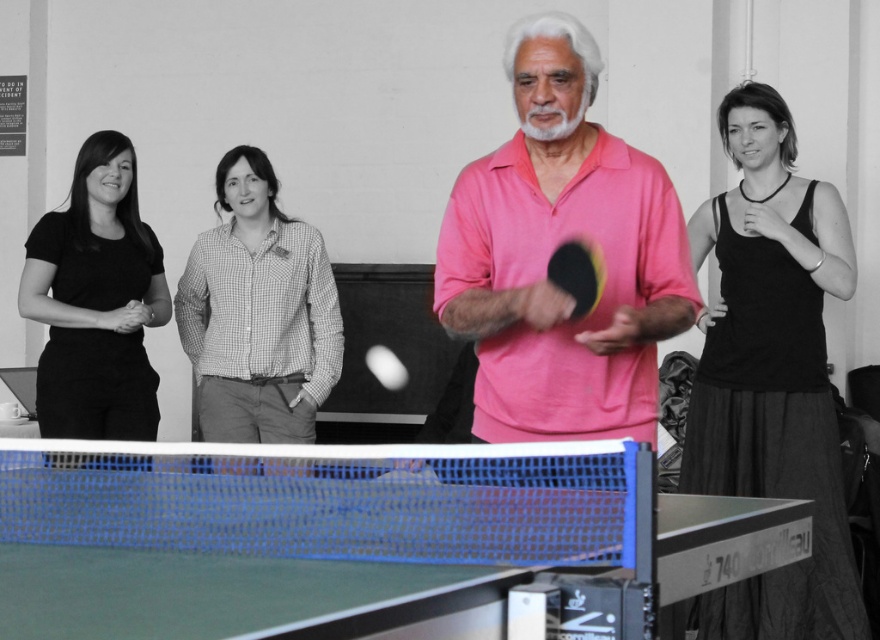
Question: Which object is the closest to the green rubber table tennis table at center?

Choices:
 (A) black cotton tank top at right
 (B) pink matte ping pong paddle at center
 (C) checkered fabric shirt at center

Answer: (B)

Question: Which of the following is the closest to the observer?

Choices:
 (A) black cotton tank top at right
 (B) checkered fabric shirt at center
 (C) green rubber table tennis table at center
 (D) black matte shirt at left

Answer: (C)

Question: Where is checkered fabric shirt at center located in relation to black matte shirt at left in the image?

Choices:
 (A) left
 (B) right

Answer: (B)

Question: Considering the real-world distances, which object is closest to the green rubber table tennis table at center?

Choices:
 (A) checkered fabric shirt at center
 (B) pink matte ping pong paddle at center
 (C) black matte shirt at left
 (D) rubber paddle at center

Answer: (B)

Question: Can you confirm if green rubber table tennis table at center is smaller than checkered fabric shirt at center?

Choices:
 (A) no
 (B) yes

Answer: (A)

Question: Is green rubber table tennis table at center wider than black cotton tank top at right?

Choices:
 (A) no
 (B) yes

Answer: (B)